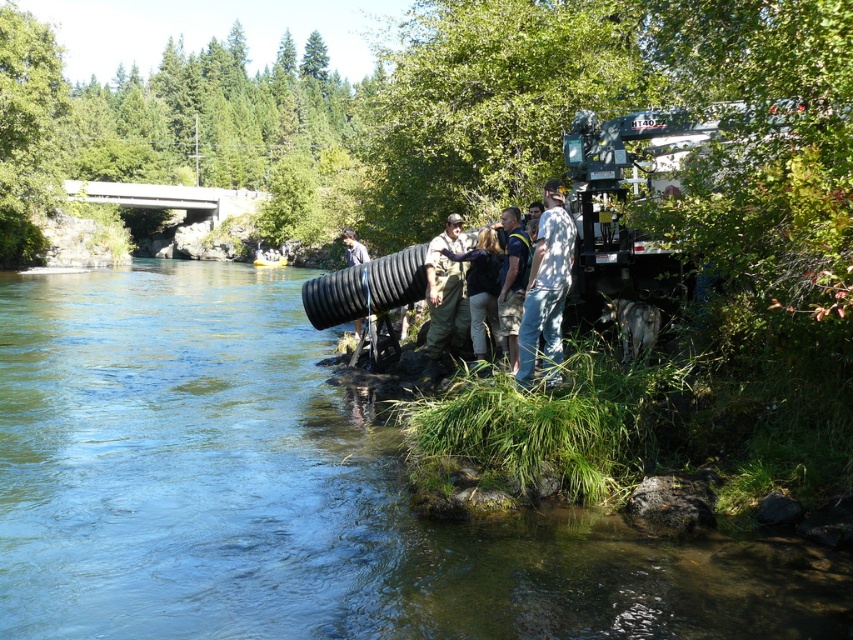
Question: Is clear water at river right wider than denim jeans at center?

Choices:
 (A) yes
 (B) no

Answer: (A)

Question: Can you confirm if clear water at river right is thinner than dark brown leather jacket at center?

Choices:
 (A) yes
 (B) no

Answer: (B)

Question: Among these points, which one is farthest from the camera?

Choices:
 (A) (502, 257)
 (B) (531, 339)
 (C) (560, 292)
 (D) (518, 237)

Answer: (A)

Question: Considering the relative positions of camouflage pants at center and dark brown leather jacket at center in the image provided, where is camouflage pants at center located with respect to dark brown leather jacket at center?

Choices:
 (A) below
 (B) above

Answer: (B)

Question: Which object is positioned farthest from the dark brown leather jacket at center?

Choices:
 (A) blue fabric shirt at center
 (B) denim jeans at center
 (C) clear water at river right
 (D) camouflage pants at center

Answer: (C)

Question: Which of these objects is positioned farthest from the clear water at river right?

Choices:
 (A) blue fabric shirt at center
 (B) denim jeans at center
 (C) camouflage pants at center

Answer: (A)